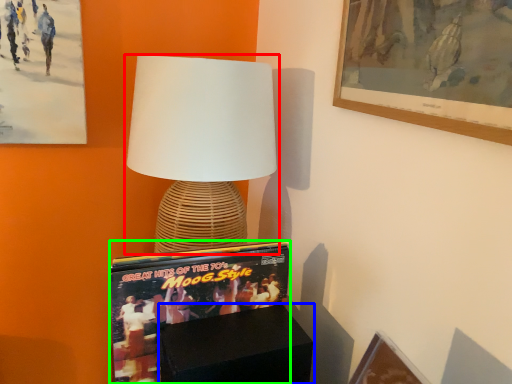
Question: Which object is the closest to the lamp (highlighted by a red box)? Choose among these: furniture (highlighted by a blue box) or magazine (highlighted by a green box).

Choices:
 (A) furniture
 (B) magazine

Answer: (B)